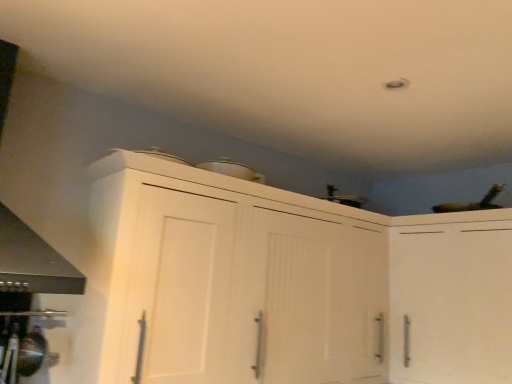
Question: Is white matte cabinet at upper center, which is counted as the first cabinetry, starting from the left, taller or shorter than white matte cabinet at upper right, the 2th cabinetry in the left-to-right sequence?

Choices:
 (A) short
 (B) tall

Answer: (B)

Question: From a real-world perspective, is white matte cabinet at upper center, which is counted as the first cabinetry, starting from the left, positioned above or below white matte cabinet at upper right, the 2th cabinetry in the left-to-right sequence?

Choices:
 (A) above
 (B) below

Answer: (A)

Question: In the image, is white matte cabinet at upper center, which is counted as the first cabinetry, starting from the left, on the left side or the right side of white matte cabinet at upper right, the 2th cabinetry in the left-to-right sequence?

Choices:
 (A) left
 (B) right

Answer: (A)

Question: From a real-world perspective, is white matte cabinet at upper right, the 1th cabinetry when ordered from right to left, physically located above or below white matte cabinet at upper center, which appears as the 2th cabinetry when viewed from the right?

Choices:
 (A) below
 (B) above

Answer: (A)

Question: Considering the positions of point (425, 337) and point (229, 195), is point (425, 337) closer or farther from the camera than point (229, 195)?

Choices:
 (A) closer
 (B) farther

Answer: (B)

Question: From the image's perspective, relative to white matte cabinet at upper center, which appears as the 2th cabinetry when viewed from the right, is white matte cabinet at upper right, the 2th cabinetry in the left-to-right sequence, above or below?

Choices:
 (A) above
 (B) below

Answer: (B)

Question: Relative to white matte cabinet at upper center, which appears as the 2th cabinetry when viewed from the right, is white matte cabinet at upper right, the 1th cabinetry when ordered from right to left, in front or behind?

Choices:
 (A) behind
 (B) front

Answer: (A)